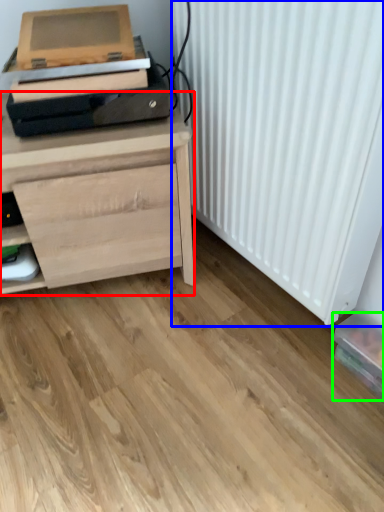
Question: Which object is the farthest from chest of drawers (highlighted by a red box)? Choose among these: radiator (highlighted by a blue box) or box (highlighted by a green box).

Choices:
 (A) radiator
 (B) box

Answer: (B)